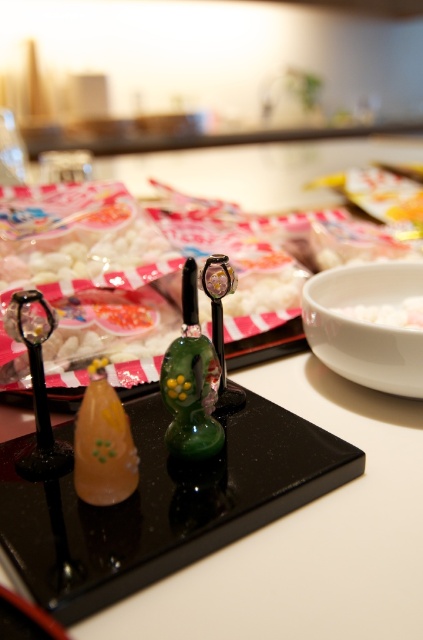
Does translucent orange glass at left lie behind white matte rice at center?

No, translucent orange glass at left is in front of white matte rice at center.

Is translucent orange glass at left bigger than white matte rice at center?

Yes, translucent orange glass at left is bigger than white matte rice at center.

The height and width of the screenshot is (640, 423). I want to click on translucent orange glass at left, so click(x=102, y=444).

The image size is (423, 640). I want to click on translucent orange glass at left, so click(102, 444).

Does green glass figurine at center lie in front of translucent orange glass at left?

No, it is behind translucent orange glass at left.

How distant is green glass figurine at center from translucent orange glass at left?

The distance of green glass figurine at center from translucent orange glass at left is 2.32 inches.

Image resolution: width=423 pixels, height=640 pixels. I want to click on green glass figurine at center, so click(x=192, y=381).

Which is below, green glass figurine at center or white matte rice at center?

green glass figurine at center is below.

Does green glass figurine at center appear under white matte rice at center?

Correct, green glass figurine at center is located below white matte rice at center.

Which is in front, point (170, 445) or point (335, 308)?

Point (170, 445) is more forward.

Locate an element on the screen. Image resolution: width=423 pixels, height=640 pixels. green glass figurine at center is located at coordinates (192, 381).